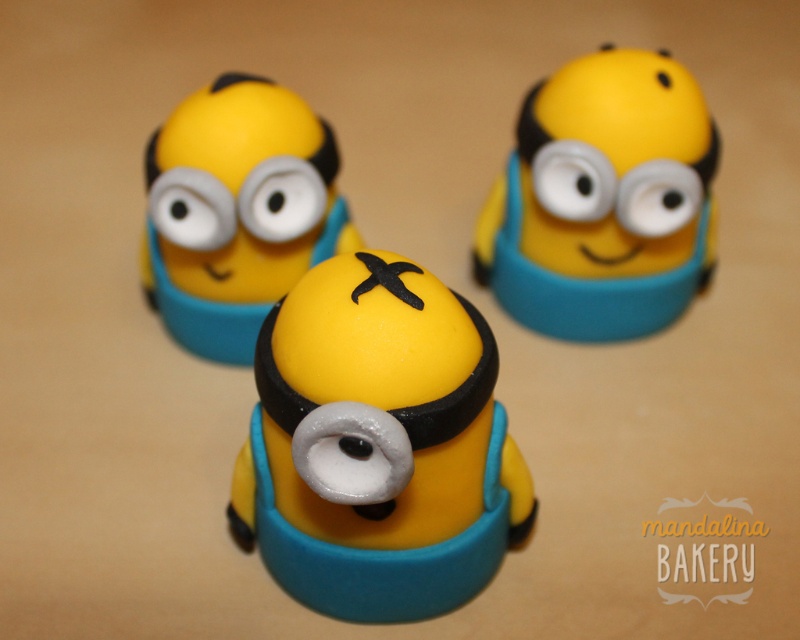
Question: Which is nearer to the yellow matte minion at center?

Choices:
 (A) matte yellow fondant minion at center
 (B) yellow matte minion at upper right

Answer: (A)

Question: Does yellow matte minion at center have a smaller size compared to yellow matte minion at upper right?

Choices:
 (A) no
 (B) yes

Answer: (A)

Question: Which point appears closest to the camera in this image?

Choices:
 (A) (329, 180)
 (B) (502, 214)

Answer: (A)

Question: Which object is the farthest from the yellow matte minion at center?

Choices:
 (A) matte yellow fondant minion at center
 (B) yellow matte minion at upper right

Answer: (B)

Question: Is yellow matte minion at center to the left of matte yellow fondant minion at center from the viewer's perspective?

Choices:
 (A) yes
 (B) no

Answer: (B)

Question: Is yellow matte minion at center in front of yellow matte minion at upper right?

Choices:
 (A) no
 (B) yes

Answer: (B)